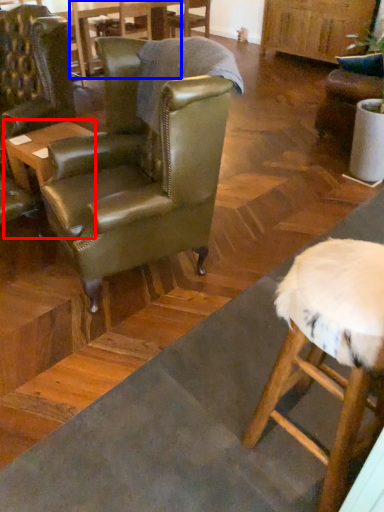
Question: Which object is further to the camera taking this photo, table (highlighted by a red box) or table (highlighted by a blue box)?

Choices:
 (A) table
 (B) table

Answer: (B)